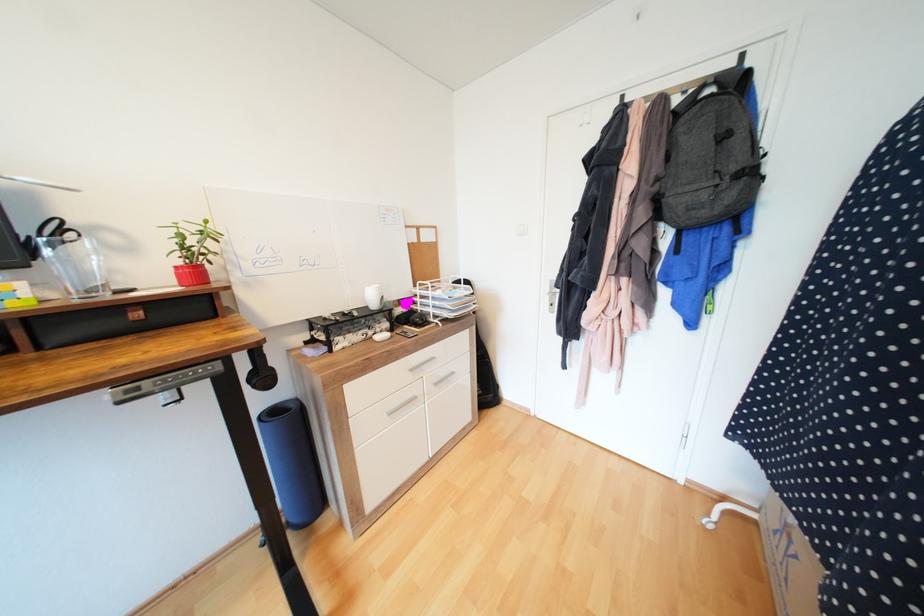
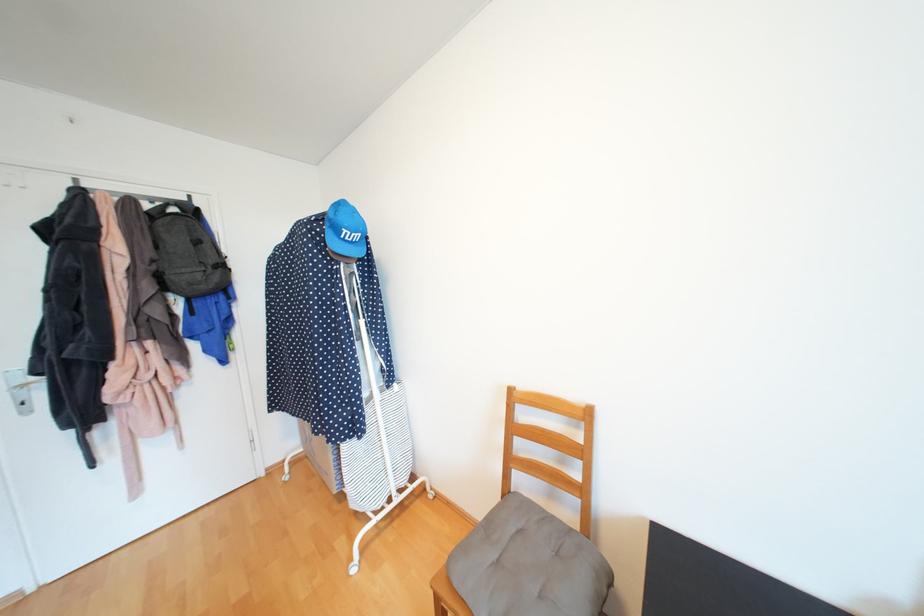
In the second image, find the point that corresponds to the point at 663,180 in the first image.

(160, 262)